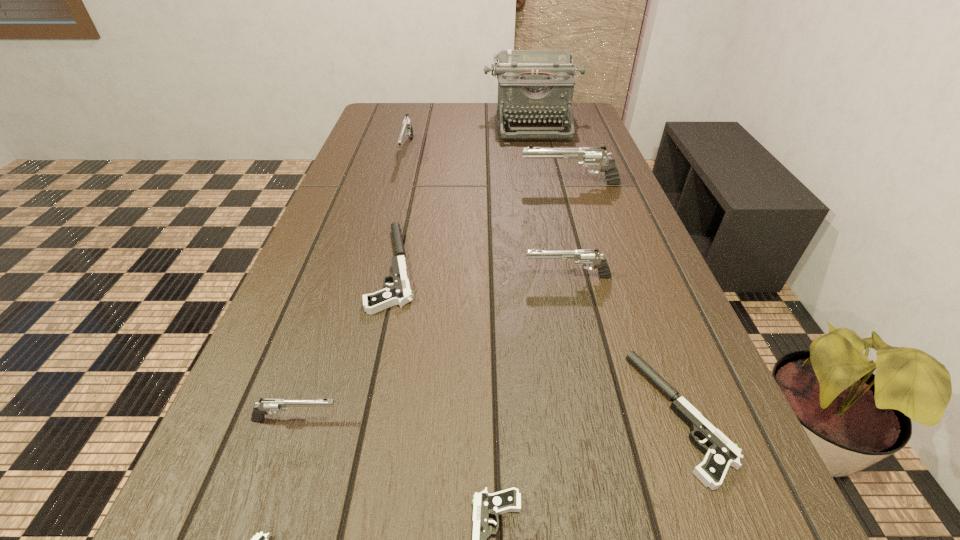
Locate which pistol is the eighth closest to the typewriter. Please provide its 2D coordinates. Your answer should be formatted as a tuple, i.e. [(x, y)], where the tuple contains the x and y coordinates of a point satisfying the conditions above.

[(260, 539)]

Where is `pistol that is the sixth closest to the smallest black pistol`? pistol that is the sixth closest to the smallest black pistol is located at coordinates (586, 156).

Identify which silver pistol is the fourth nearest to the second black pistol from left to right. Please provide its 2D coordinates. Your answer should be formatted as a tuple, i.e. [(x, y)], where the tuple contains the x and y coordinates of a point satisfying the conditions above.

[(586, 156)]

Choose which silver pistol is the third nearest neighbor to the nearest silver pistol. Please provide its 2D coordinates. Your answer should be formatted as a tuple, i.e. [(x, y)], where the tuple contains the x and y coordinates of a point satisfying the conditions above.

[(407, 129)]

Select which black pistol appears as the second closest to the biggest silver pistol. Please provide its 2D coordinates. Your answer should be formatted as a tuple, i.e. [(x, y)], where the tuple contains the x and y coordinates of a point satisfying the conditions above.

[(722, 452)]

Locate which black pistol is the third closest to the third smallest black pistol. Please provide its 2D coordinates. Your answer should be formatted as a tuple, i.e. [(x, y)], where the tuple contains the x and y coordinates of a point satisfying the conditions above.

[(260, 539)]

In order to click on blank area in the image that satisfies the following two spatial constraints: 1. on the front-facing side of the farthest silver pistol; 2. on the front-facing side of the fifth shortest object in this screenshot , I will do `click(337, 420)`.

This screenshot has width=960, height=540. In order to click on free point that satisfies the following two spatial constraints: 1. on the front-facing side of the third tallest object; 2. on the front-facing side of the fifth shortest pistol in this screenshot , I will do `click(337, 420)`.